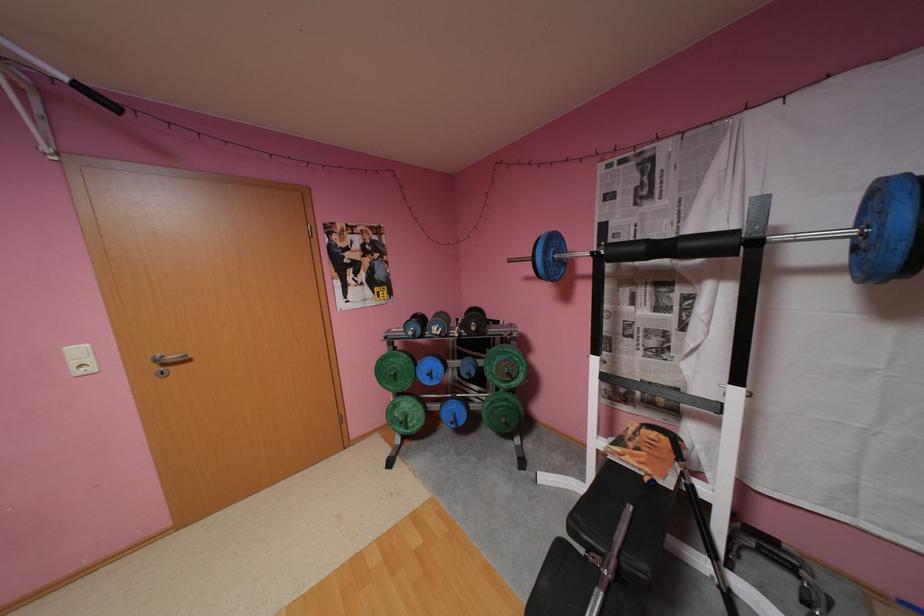
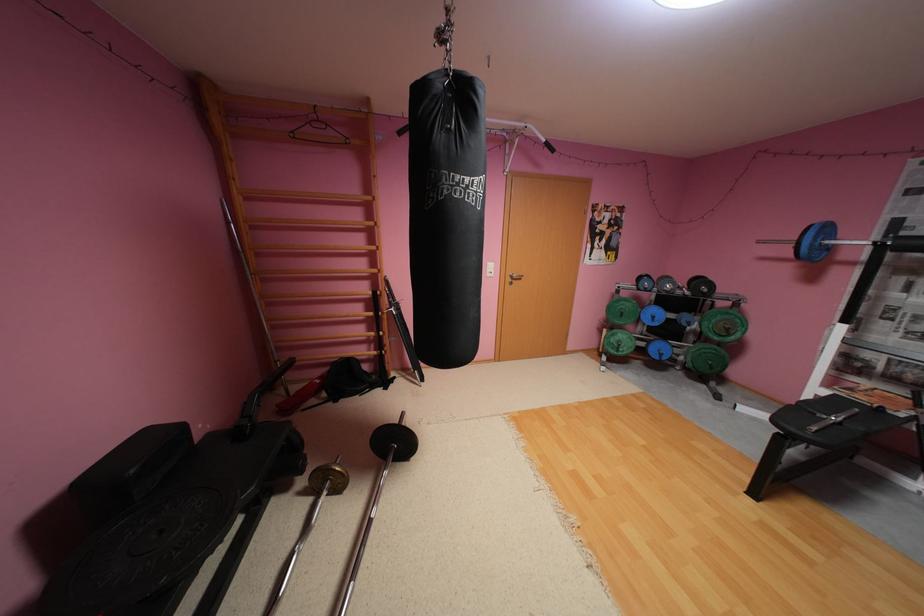
In the second image, find the point that corresponds to (x=521, y=378) in the first image.

(737, 334)